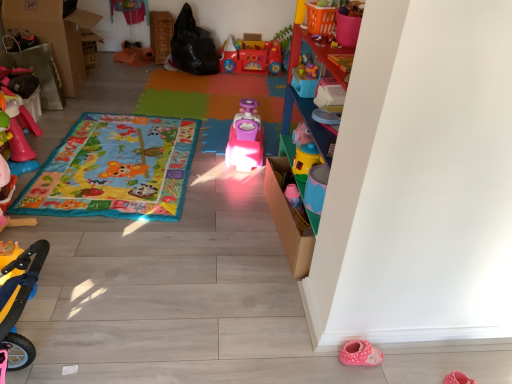
Where is `vacant area that lies between matte pink car at center, arranged as the second blanket when viewed from the front, and multicolored fabric play mat at center, the 1th blanket viewed from the front`? The height and width of the screenshot is (384, 512). vacant area that lies between matte pink car at center, arranged as the second blanket when viewed from the front, and multicolored fabric play mat at center, the 1th blanket viewed from the front is located at coordinates (197, 158).